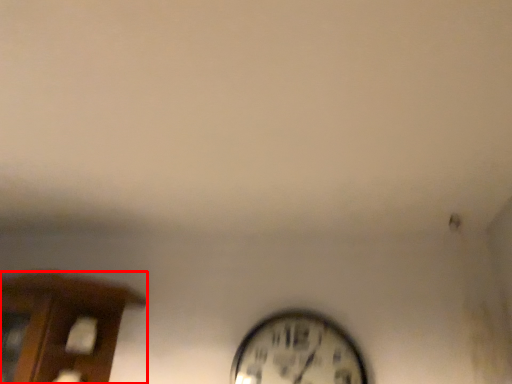
Question: From the image's perspective, what is the correct spatial relationship of furniture (annotated by the red box) in relation to wall clock?

Choices:
 (A) below
 (B) above

Answer: (B)